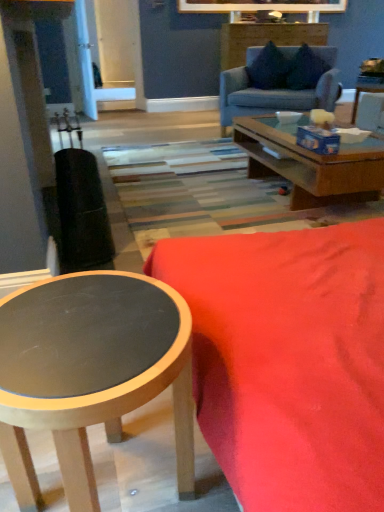
The height and width of the screenshot is (512, 384). Describe the element at coordinates (90, 372) in the screenshot. I see `matte black coffee table at lower left` at that location.

What do you see at coordinates (269, 69) in the screenshot? This screenshot has height=512, width=384. I see `velvet dark blue pillow at upper center, the first pillow in the left-to-right sequence` at bounding box center [269, 69].

I want to click on suede-like dark blue pillow at upper center, marked as the 2th pillow in a left-to-right arrangement, so click(x=305, y=69).

Image resolution: width=384 pixels, height=512 pixels. Describe the element at coordinates (288, 361) in the screenshot. I see `velvet red couch at lower right, the second studio couch in the back-to-front sequence` at that location.

Identify the location of matte black coffee table at lower left. (90, 372).

Between light blue fabric couch at upper center, arranged as the first studio couch when viewed from the back, and matte black coffee table at lower left, which one appears on the left side from the viewer's perspective?

matte black coffee table at lower left is more to the left.

Who is smaller, light blue fabric couch at upper center, which appears as the 1th studio couch when viewed from the top, or matte black coffee table at lower left?

With smaller size is matte black coffee table at lower left.

Which of these two, light blue fabric couch at upper center, marked as the second studio couch in a bottom-to-top arrangement, or matte black coffee table at lower left, stands taller?

Standing taller between the two is light blue fabric couch at upper center, marked as the second studio couch in a bottom-to-top arrangement.

In the image, is matte black coffee table at lower left on the left side or the right side of suede-like dark blue pillow at upper center, which is the 1th pillow in right-to-left order?

Answer: matte black coffee table at lower left is positioned on suede-like dark blue pillow at upper center, which is the 1th pillow in right-to-left order,'s left side.

Is matte black coffee table at lower left in front of suede-like dark blue pillow at upper center, which is the 1th pillow in right-to-left order?

Yes, the depth of matte black coffee table at lower left is less than that of suede-like dark blue pillow at upper center, which is the 1th pillow in right-to-left order.

From a real-world perspective, is matte black coffee table at lower left positioned over wooden side table at upper right based on gravity?

No, from a real-world perspective, matte black coffee table at lower left is not above wooden side table at upper right.

How different are the orientations of matte black coffee table at lower left and wooden side table at upper right in degrees?

180 degrees.

From the image's perspective, between matte black coffee table at lower left and wooden side table at upper right, which one is located above?

From the image's view, wooden side table at upper right is above.

In the scene shown: Considering the positions of objects matte black coffee table at lower left and wooden side table at upper right in the image provided, who is more to the left, matte black coffee table at lower left or wooden side table at upper right?

From the viewer's perspective, matte black coffee table at lower left appears more on the left side.

From a real-world perspective, between wooden side table at upper right and suede-like dark blue pillow at upper center, which is the 1th pillow in right-to-left order, who is vertically higher?

suede-like dark blue pillow at upper center, which is the 1th pillow in right-to-left order.

Where is `side table that appears in front of the suede-like dark blue pillow at upper center, which is the 1th pillow in right-to-left order`? The image size is (384, 512). side table that appears in front of the suede-like dark blue pillow at upper center, which is the 1th pillow in right-to-left order is located at coordinates (365, 92).

How different are the orientations of wooden side table at upper right and suede-like dark blue pillow at upper center, marked as the 2th pillow in a left-to-right arrangement, in degrees?

The angular difference between wooden side table at upper right and suede-like dark blue pillow at upper center, marked as the 2th pillow in a left-to-right arrangement, is 55.5 degrees.

In the scene shown: Which object is further away from the camera taking this photo, wooden side table at upper right or suede-like dark blue pillow at upper center, which is the 1th pillow in right-to-left order?

suede-like dark blue pillow at upper center, which is the 1th pillow in right-to-left order, is further from the camera.

Is velvet red couch at lower right, marked as the first studio couch in a front-to-back arrangement, at the right side of matte black coffee table at lower left?

Indeed, velvet red couch at lower right, marked as the first studio couch in a front-to-back arrangement, is positioned on the right side of matte black coffee table at lower left.

Does velvet red couch at lower right, marked as the first studio couch in a front-to-back arrangement, have a lesser height compared to matte black coffee table at lower left?

Yes, velvet red couch at lower right, marked as the first studio couch in a front-to-back arrangement, is shorter than matte black coffee table at lower left.

Does velvet red couch at lower right, marked as the first studio couch in a front-to-back arrangement, touch matte black coffee table at lower left?

No.

From the image's perspective, is velvet red couch at lower right, marked as the first studio couch in a front-to-back arrangement, on matte black coffee table at lower left?

Yes, from the image's perspective, velvet red couch at lower right, marked as the first studio couch in a front-to-back arrangement, is over matte black coffee table at lower left.

Is suede-like dark blue pillow at upper center, which is the 1th pillow in right-to-left order, thinner than light blue fabric couch at upper center, which is the 2th studio couch from front to back?

Yes, suede-like dark blue pillow at upper center, which is the 1th pillow in right-to-left order, is thinner than light blue fabric couch at upper center, which is the 2th studio couch from front to back.

What's the angular difference between suede-like dark blue pillow at upper center, which is the 1th pillow in right-to-left order, and light blue fabric couch at upper center, which is the 2th studio couch from front to back,'s facing directions?

3.22 degrees separate the facing orientations of suede-like dark blue pillow at upper center, which is the 1th pillow in right-to-left order, and light blue fabric couch at upper center, which is the 2th studio couch from front to back.

Is suede-like dark blue pillow at upper center, marked as the 2th pillow in a left-to-right arrangement, looking in the opposite direction of light blue fabric couch at upper center, which is the 2th studio couch from front to back?

That's right, suede-like dark blue pillow at upper center, marked as the 2th pillow in a left-to-right arrangement, is facing away from light blue fabric couch at upper center, which is the 2th studio couch from front to back.

Which object is positioned more to the right, suede-like dark blue pillow at upper center, marked as the 2th pillow in a left-to-right arrangement, or light blue fabric couch at upper center, which appears as the 1th studio couch when viewed from the top?

suede-like dark blue pillow at upper center, marked as the 2th pillow in a left-to-right arrangement.

Measure the distance from suede-like dark blue pillow at upper center, marked as the 2th pillow in a left-to-right arrangement, to velvet dark blue pillow at upper center, arranged as the second pillow when viewed from the right.

suede-like dark blue pillow at upper center, marked as the 2th pillow in a left-to-right arrangement, and velvet dark blue pillow at upper center, arranged as the second pillow when viewed from the right, are 7.47 inches apart from each other.

Would you say suede-like dark blue pillow at upper center, which is the 1th pillow in right-to-left order, is to the left or to the right of velvet dark blue pillow at upper center, arranged as the second pillow when viewed from the right, in the picture?

suede-like dark blue pillow at upper center, which is the 1th pillow in right-to-left order, is positioned on velvet dark blue pillow at upper center, arranged as the second pillow when viewed from the right,'s right side.

Is suede-like dark blue pillow at upper center, which is the 1th pillow in right-to-left order, not within velvet dark blue pillow at upper center, arranged as the second pillow when viewed from the right?

Absolutely, suede-like dark blue pillow at upper center, which is the 1th pillow in right-to-left order, is external to velvet dark blue pillow at upper center, arranged as the second pillow when viewed from the right.

The height and width of the screenshot is (512, 384). What are the coordinates of `studio couch behind the matte black coffee table at lower left` in the screenshot? It's located at (276, 93).

At what (x,y) coordinates should I click in order to perform the action: click on coffee table in front of the suede-like dark blue pillow at upper center, marked as the 2th pillow in a left-to-right arrangement. Please return your answer as a coordinate pair (x, y). This screenshot has height=512, width=384. Looking at the image, I should click on (90, 372).

In the scene shown: When comparing their distances from light blue fabric couch at upper center, marked as the second studio couch in a bottom-to-top arrangement, does suede-like dark blue pillow at upper center, marked as the 2th pillow in a left-to-right arrangement, or velvet red couch at lower right, which ranks as the second studio couch in top-to-bottom order, seem further?

The object further to light blue fabric couch at upper center, marked as the second studio couch in a bottom-to-top arrangement, is velvet red couch at lower right, which ranks as the second studio couch in top-to-bottom order.

Looking at the image, which one is located closer to velvet dark blue pillow at upper center, the first pillow in the left-to-right sequence, wooden side table at upper right or suede-like dark blue pillow at upper center, which is the 1th pillow in right-to-left order?

Based on the image, suede-like dark blue pillow at upper center, which is the 1th pillow in right-to-left order, appears to be nearer to velvet dark blue pillow at upper center, the first pillow in the left-to-right sequence.

Estimate the real-world distances between objects in this image. Which object is further from matte black coffee table at lower left, wooden side table at upper right or light blue fabric couch at upper center, marked as the second studio couch in a bottom-to-top arrangement?

wooden side table at upper right is positioned further to the anchor matte black coffee table at lower left.

Based on their spatial positions, is suede-like dark blue pillow at upper center, which is the 1th pillow in right-to-left order, or velvet dark blue pillow at upper center, the first pillow in the left-to-right sequence, closer to velvet red couch at lower right, marked as the 1th studio couch in a bottom-to-top arrangement?

suede-like dark blue pillow at upper center, which is the 1th pillow in right-to-left order.

Estimate the real-world distances between objects in this image. Which object is further from velvet dark blue pillow at upper center, the first pillow in the left-to-right sequence, matte black coffee table at lower left or velvet red couch at lower right, the second studio couch in the back-to-front sequence?

The object further to velvet dark blue pillow at upper center, the first pillow in the left-to-right sequence, is matte black coffee table at lower left.

From the image, which object appears to be nearer to velvet red couch at lower right, marked as the first studio couch in a front-to-back arrangement, suede-like dark blue pillow at upper center, which is the 1th pillow in right-to-left order, or light blue fabric couch at upper center, arranged as the first studio couch when viewed from the back?

Among the two, light blue fabric couch at upper center, arranged as the first studio couch when viewed from the back, is located nearer to velvet red couch at lower right, marked as the first studio couch in a front-to-back arrangement.

Looking at this image, estimate the real-world distances between objects in this image. Which object is closer to suede-like dark blue pillow at upper center, which is the 1th pillow in right-to-left order, light blue fabric couch at upper center, which appears as the 1th studio couch when viewed from the top, or matte black coffee table at lower left?

light blue fabric couch at upper center, which appears as the 1th studio couch when viewed from the top, is positioned closer to the anchor suede-like dark blue pillow at upper center, which is the 1th pillow in right-to-left order.

Considering their positions, is velvet red couch at lower right, which ranks as the second studio couch in top-to-bottom order, positioned further to light blue fabric couch at upper center, arranged as the first studio couch when viewed from the back, than velvet dark blue pillow at upper center, the first pillow in the left-to-right sequence?

The object further to light blue fabric couch at upper center, arranged as the first studio couch when viewed from the back, is velvet red couch at lower right, which ranks as the second studio couch in top-to-bottom order.

Identify the location of coffee table between velvet red couch at lower right, marked as the 1th studio couch in a bottom-to-top arrangement, and suede-like dark blue pillow at upper center, which is the 1th pillow in right-to-left order, in the front-back direction. The height and width of the screenshot is (512, 384). (90, 372).

Where is `side table located between velvet red couch at lower right, which ranks as the second studio couch in top-to-bottom order, and suede-like dark blue pillow at upper center, which is the 1th pillow in right-to-left order, in the depth direction`? This screenshot has width=384, height=512. side table located between velvet red couch at lower right, which ranks as the second studio couch in top-to-bottom order, and suede-like dark blue pillow at upper center, which is the 1th pillow in right-to-left order, in the depth direction is located at coordinates (365, 92).

Identify the location of pillow situated between velvet dark blue pillow at upper center, arranged as the second pillow when viewed from the right, and wooden side table at upper right from left to right. (305, 69).

The image size is (384, 512). Identify the location of studio couch between velvet red couch at lower right, marked as the first studio couch in a front-to-back arrangement, and velvet dark blue pillow at upper center, the first pillow in the left-to-right sequence, along the z-axis. (276, 93).